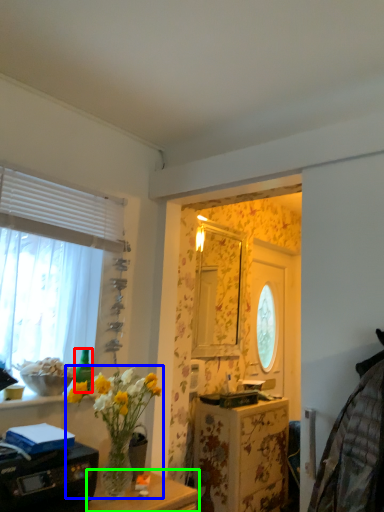
Question: Which object is positioned closest to bottle (highlighted by a red box)? Select from houseplant (highlighted by a blue box) and table (highlighted by a green box).

Choices:
 (A) houseplant
 (B) table

Answer: (A)